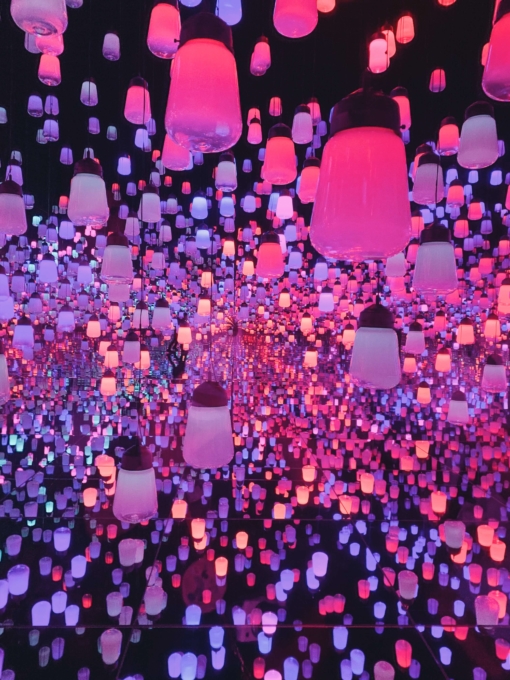
The image size is (510, 680). I want to click on small light pink bulbs, so click(188, 333), click(205, 536), click(246, 277), click(307, 357), click(111, 377).